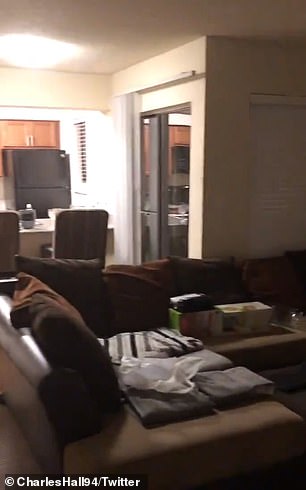
Where is `boxes piled on sofa`? The width and height of the screenshot is (306, 490). boxes piled on sofa is located at coordinates (194, 322), (196, 301), (241, 326).